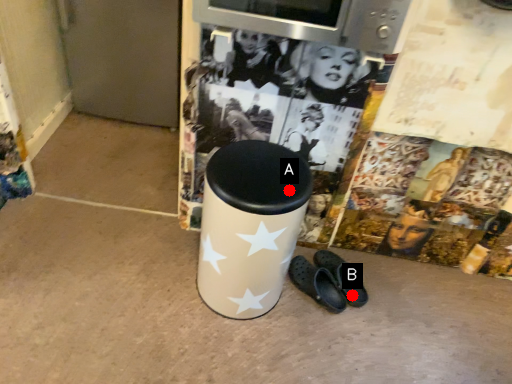
Question: Two points are circled on the image, labeled by A and B beside each circle. Which point is farther to the camera?

Choices:
 (A) A is further
 (B) B is further

Answer: (B)